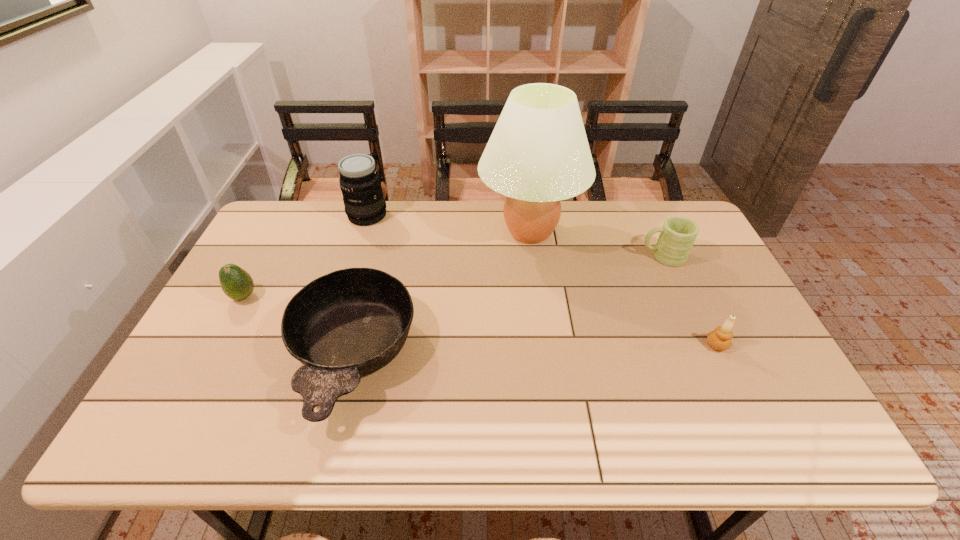
Locate an element on the screen. vacant space that satisfies the following two spatial constraints: 1. on the side of the mug with the handle; 2. on the back side of the candle_holder is located at coordinates (702, 345).

Find the location of a particular element. vacant space that satisfies the following two spatial constraints: 1. on the side of the mug with the handle; 2. on the right side of the candle_holder is located at coordinates (702, 345).

Where is `free space that satisfies the following two spatial constraints: 1. on the shade of the tallest object; 2. on the right side of the candle_holder`? free space that satisfies the following two spatial constraints: 1. on the shade of the tallest object; 2. on the right side of the candle_holder is located at coordinates (545, 345).

Where is `free space that satisfies the following two spatial constraints: 1. on the back side of the candle_holder; 2. on the side of the mug with the handle`? Image resolution: width=960 pixels, height=540 pixels. free space that satisfies the following two spatial constraints: 1. on the back side of the candle_holder; 2. on the side of the mug with the handle is located at coordinates (675, 257).